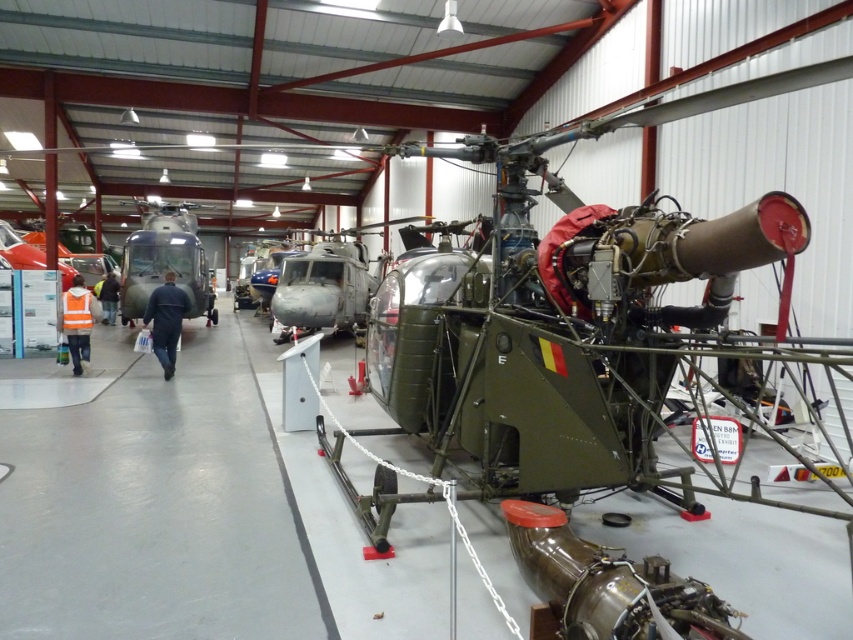
Question: Does metallic gray helicopter at center appear over matte black helicopter at center?

Choices:
 (A) no
 (B) yes

Answer: (A)

Question: Which point is closer to the camera?

Choices:
 (A) (293, 289)
 (B) (212, 305)

Answer: (A)

Question: Which point is farther to the camera?

Choices:
 (A) (144, 291)
 (B) (326, 276)

Answer: (B)

Question: Can you confirm if metallic gray helicopter at center is positioned below matte black helicopter at center?

Choices:
 (A) no
 (B) yes

Answer: (B)

Question: Can you confirm if metallic gray helicopter at center is positioned to the right of matte black helicopter at center?

Choices:
 (A) no
 (B) yes

Answer: (B)